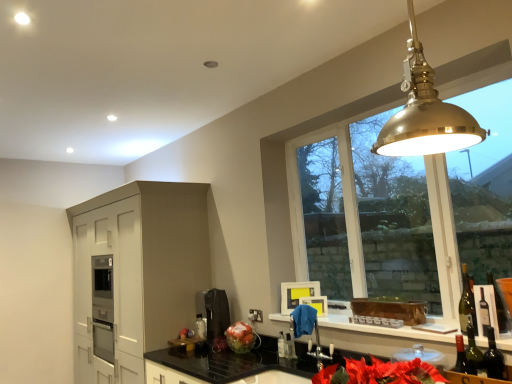
Question: Can you confirm if green glass wine bottle at right, arranged as the 3th wine bottle when viewed from the front, is smaller than green glass wine bottle at lower right, the third wine bottle from the back?

Choices:
 (A) no
 (B) yes

Answer: (A)

Question: Is green glass wine bottle at lower right, the third wine bottle from the back, at the back of green glass wine bottle at right, acting as the first wine bottle starting from the back?

Choices:
 (A) no
 (B) yes

Answer: (A)

Question: Does green glass wine bottle at right, acting as the first wine bottle starting from the back, have a lesser width compared to green glass wine bottle at lower right, the first wine bottle in the front-to-back sequence?

Choices:
 (A) no
 (B) yes

Answer: (A)

Question: From the image's perspective, is green glass wine bottle at right, arranged as the 3th wine bottle when viewed from the front, beneath green glass wine bottle at lower right, the first wine bottle in the front-to-back sequence?

Choices:
 (A) yes
 (B) no

Answer: (B)

Question: Is green glass wine bottle at right, arranged as the 3th wine bottle when viewed from the front, with green glass wine bottle at lower right, the first wine bottle in the front-to-back sequence?

Choices:
 (A) yes
 (B) no

Answer: (B)

Question: Based on their sizes in the image, would you say green glass wine bottle at right, positioned as the 2th wine bottle in front-to-back order, is bigger or smaller than black matte coffee machine at center?

Choices:
 (A) big
 (B) small

Answer: (B)

Question: Is green glass wine bottle at right, positioned as the 2th wine bottle in front-to-back order, in front of or behind black matte coffee machine at center in the image?

Choices:
 (A) behind
 (B) front

Answer: (B)

Question: Which is correct: green glass wine bottle at right, the 2th wine bottle from the back, is inside black matte coffee machine at center, or outside of it?

Choices:
 (A) outside
 (B) inside

Answer: (A)

Question: From the image's perspective, is green glass wine bottle at right, the 2th wine bottle from the back, positioned above or below black matte coffee machine at center?

Choices:
 (A) below
 (B) above

Answer: (B)

Question: From a real-world perspective, is green glass wine bottle at right, positioned as the 2th wine bottle in front-to-back order, above or below matte white cabinet at left?

Choices:
 (A) below
 (B) above

Answer: (B)

Question: Considering their positions, is green glass wine bottle at right, positioned as the 2th wine bottle in front-to-back order, located in front of or behind matte white cabinet at left?

Choices:
 (A) behind
 (B) front

Answer: (B)

Question: Is point (501, 304) positioned closer to the camera than point (150, 269)?

Choices:
 (A) farther
 (B) closer

Answer: (B)

Question: Based on their positions, is green glass wine bottle at right, the 2th wine bottle from the back, located to the left or right of matte white cabinet at left?

Choices:
 (A) left
 (B) right

Answer: (B)

Question: Considering the positions of point (437, 332) and point (285, 342), is point (437, 332) closer or farther from the camera than point (285, 342)?

Choices:
 (A) farther
 (B) closer

Answer: (B)

Question: From a real-world perspective, is white glossy window sill at lower center positioned above or below translucent glass bottle at lower center?

Choices:
 (A) above
 (B) below

Answer: (A)